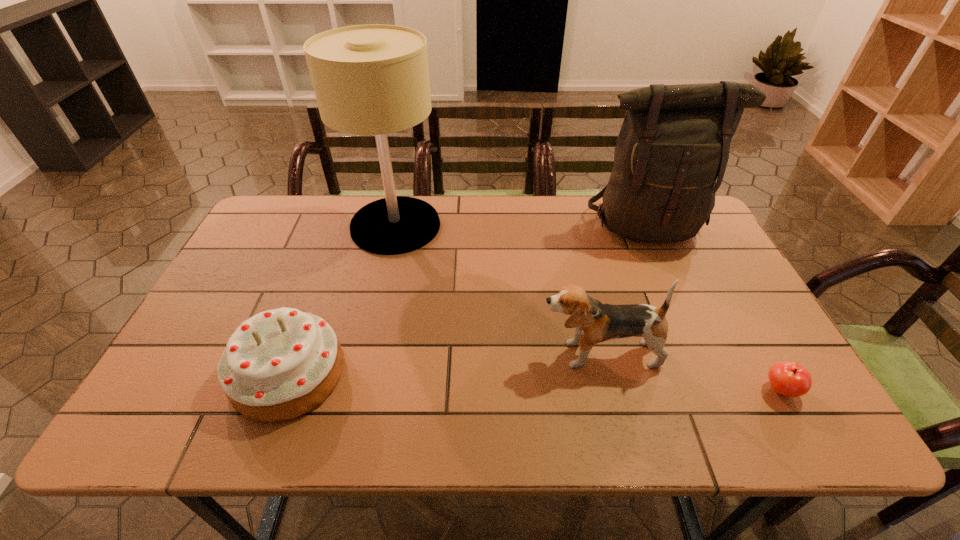
Where is `table lamp`? table lamp is located at coordinates (373, 79).

Where is `the fourth shortest object`? the fourth shortest object is located at coordinates (674, 142).

In order to click on puppy in this screenshot , I will do `click(595, 321)`.

You are a GUI agent. You are given a task and a screenshot of the screen. Output one action in this format:
    pyautogui.click(x=<x>, y=<y>)
    Task: Click on the cake
    
    Given the screenshot: What is the action you would take?
    pyautogui.click(x=279, y=364)

The width and height of the screenshot is (960, 540). Identify the location of the shortest object. (788, 378).

This screenshot has width=960, height=540. What are the coordinates of `vacant area situated on the right of the tallest object` in the screenshot? It's located at pyautogui.click(x=462, y=226).

Find the location of `free spot located on the open flap of the backpack`. free spot located on the open flap of the backpack is located at coordinates (701, 347).

Find the location of `vacant region located at the face of the third shortest object`. vacant region located at the face of the third shortest object is located at coordinates (405, 354).

The image size is (960, 540). Find the location of `free space located 0.210m at the face of the third shortest object`. free space located 0.210m at the face of the third shortest object is located at coordinates 451,354.

The image size is (960, 540). Find the location of `free spot located at the face of the third shortest object`. free spot located at the face of the third shortest object is located at coordinates click(397, 354).